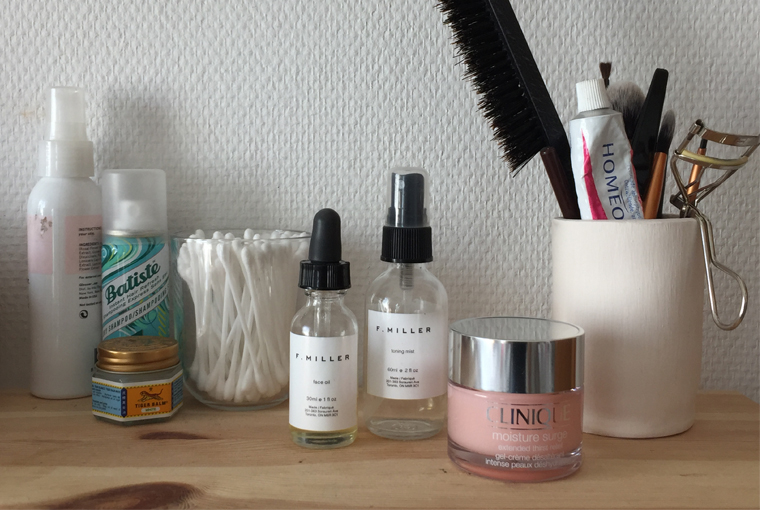
At what (x,y) coordinates should I click in order to perform the action: click on white sticker labels. Please return your answer as a coordinate pair (x, y). Looking at the image, I should click on (x=342, y=377), (x=426, y=342).